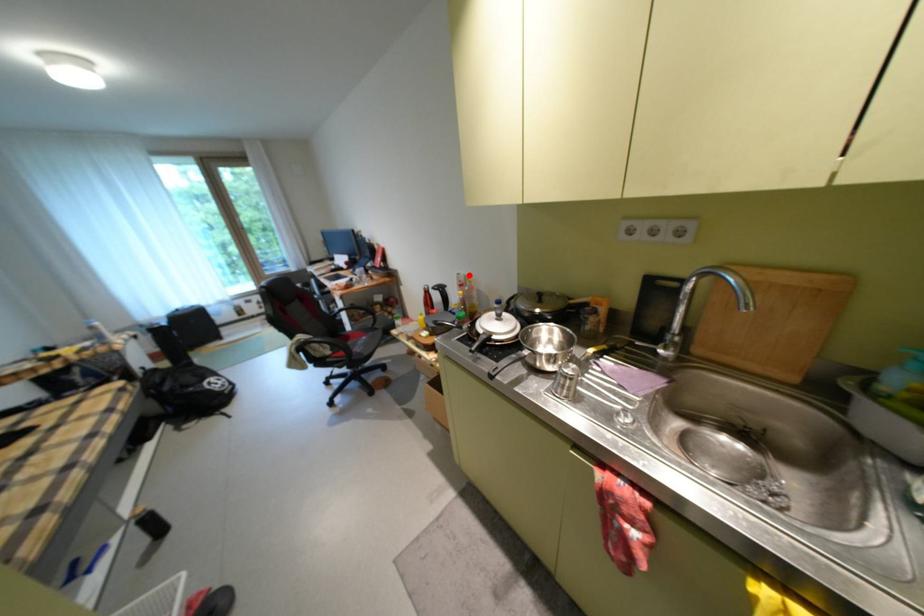
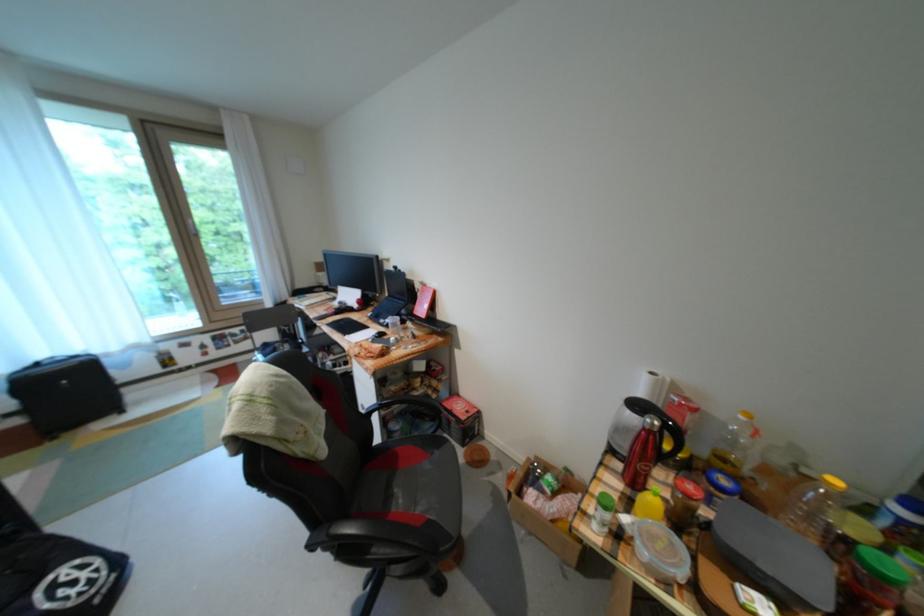
Find the pixel in the second image that matches the highlighted location in the first image.

(662, 374)